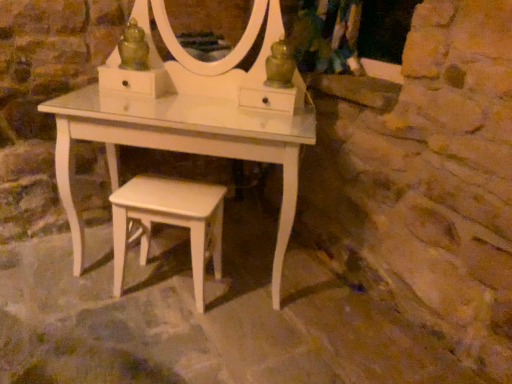
Where is `free point to the right of white matte stool at center`? free point to the right of white matte stool at center is located at coordinates (241, 307).